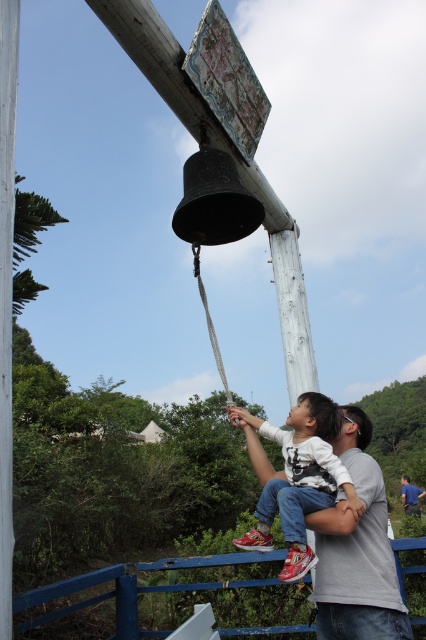
You are observing a scene where a man and a child are near a bell. The man wears a gray cotton shirt at center, and the child wears a white cotton shirt at center. Which shirt is shorter in length?

The gray cotton shirt at center is shorter than the white cotton shirt at center according to the description.

You are standing at the position of the man and child near the bell. There are two points marked on the ground in front of you. The first point is at coordinates point (319, 456) and the second point is at point (417, 492). If you want to walk towards the bell, which point should you step on first?

You should step on point (319, 456) first because it is in front of point (417, 492), meaning it is closer to the bell.

Looking at this image, you are standing in front of the bell and see the white cotton shirt at center and the gray fabric shirt at upper center. Which one is positioned higher?

The gray fabric shirt at upper center is positioned higher than the white cotton shirt at center.